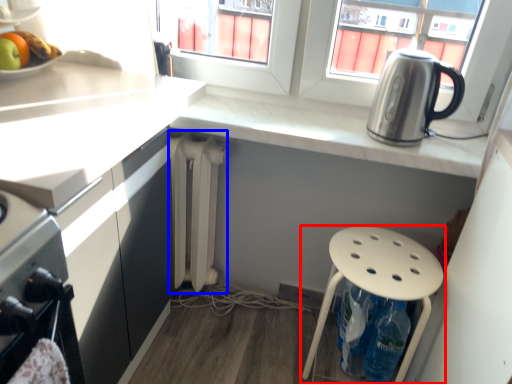
Question: Which of the following is the closest to the observer, stool (highlighted by a red box) or radiator (highlighted by a blue box)?

Choices:
 (A) stool
 (B) radiator

Answer: (A)